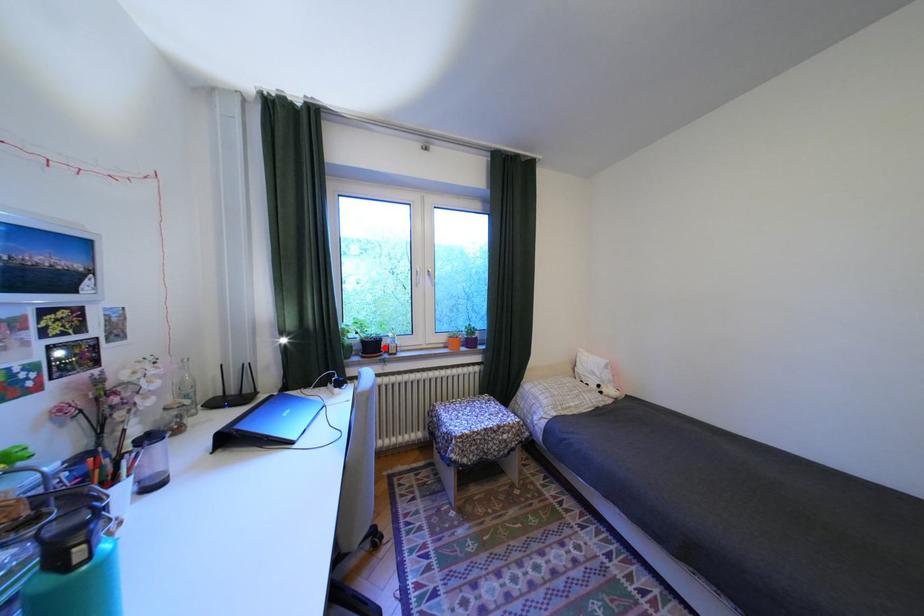
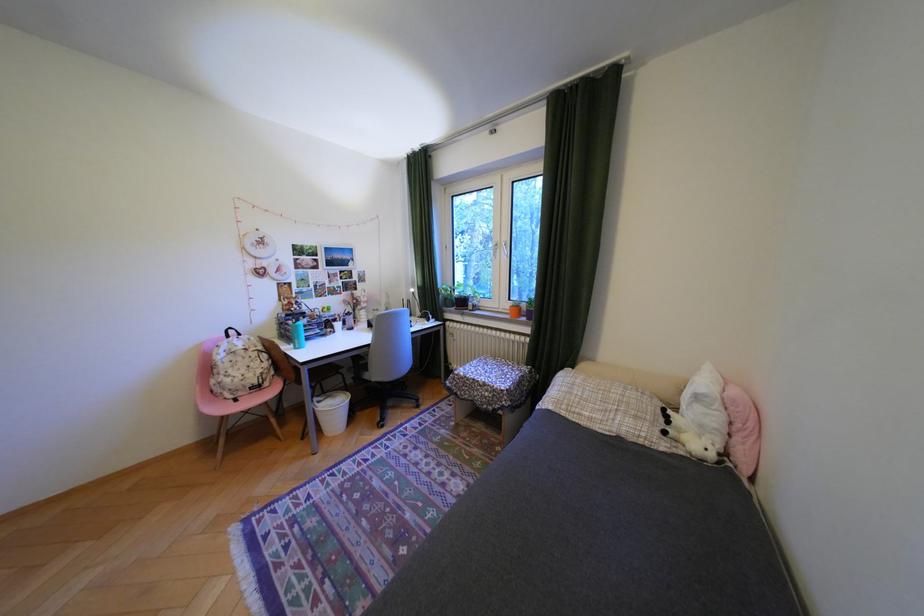
Locate, in the second image, the point that corresponds to the highlighted location in the first image.

(475, 302)